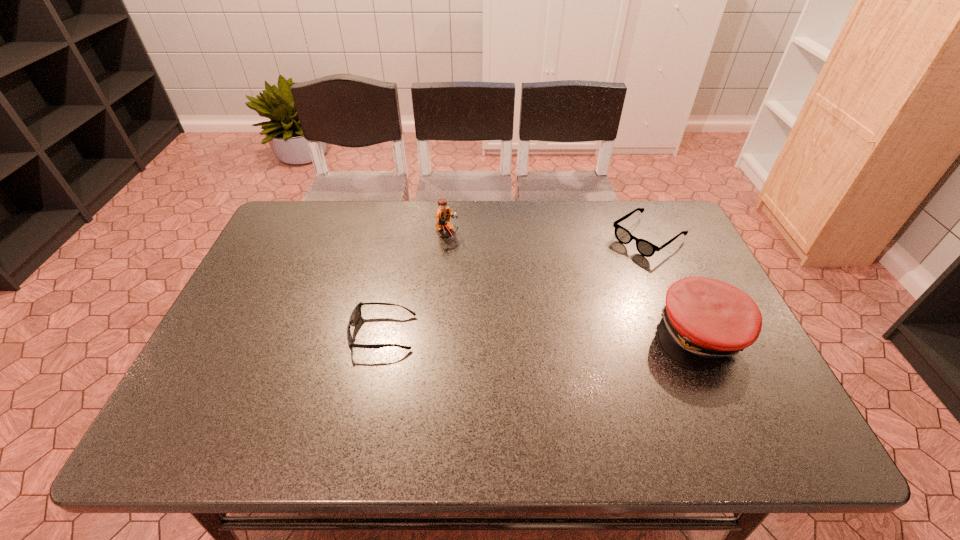
Find the location of a particular element. vacant spot on the desktop that is between the shortest object and the cap and is positioned on the arms of the spectacles is located at coordinates (512, 333).

Locate an element on the screen. The image size is (960, 540). free spot on the desktop that is between the leftmost object and the cap and is positioned holding a crossbow in the hands of the third object from right to left is located at coordinates (587, 334).